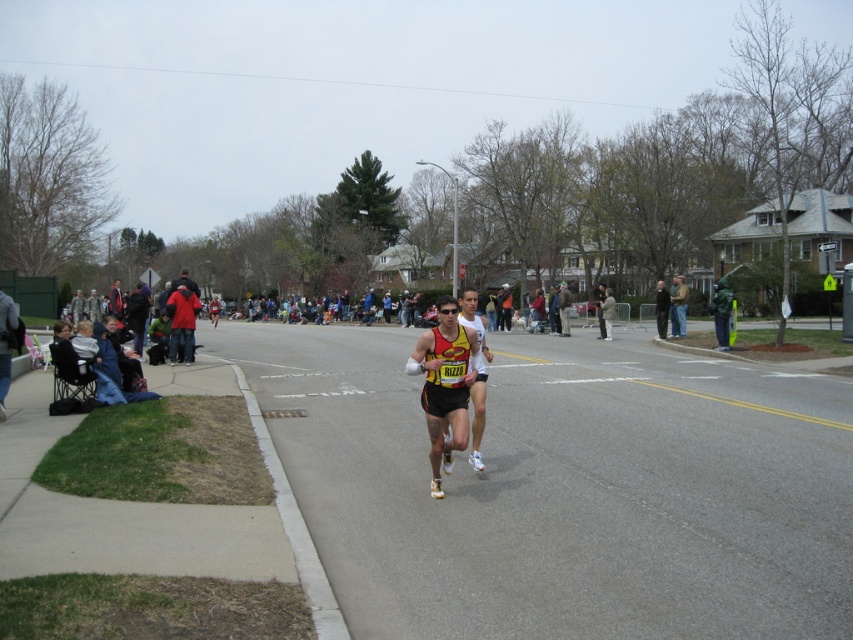
Question: Observing the image, what is the correct spatial positioning of black running suit at center in reference to yellow jersey at center?

Choices:
 (A) right
 (B) left

Answer: (B)

Question: Is black running suit at center to the right of yellow and black running suit at center from the viewer's perspective?

Choices:
 (A) no
 (B) yes

Answer: (B)

Question: Among these objects, which one is farthest from the camera?

Choices:
 (A) yellow jersey at center
 (B) black running suit at center

Answer: (A)

Question: Can you confirm if yellow and black running suit at center is wider than yellow jersey at center?

Choices:
 (A) no
 (B) yes

Answer: (A)

Question: Which point appears farthest from the camera in this image?

Choices:
 (A) click(x=560, y=301)
 (B) click(x=723, y=600)
 (C) click(x=438, y=360)

Answer: (A)

Question: Which point appears closest to the camera in this image?

Choices:
 (A) (448, 451)
 (B) (718, 513)

Answer: (B)